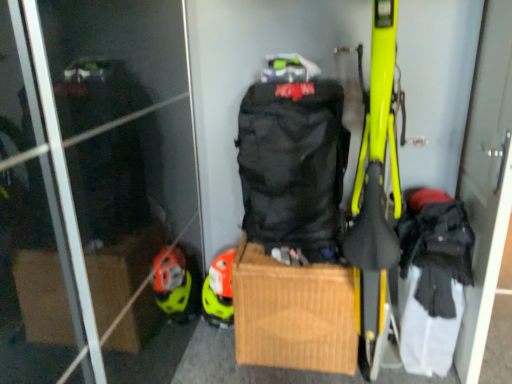
Question: Is black matte backpack at center inside or outside of brown cardboard box at center?

Choices:
 (A) outside
 (B) inside

Answer: (A)

Question: From a real-world perspective, relative to brown cardboard box at center, is black matte backpack at center vertically above or below?

Choices:
 (A) below
 (B) above

Answer: (B)

Question: Which of these objects is positioned farthest from the black matte backpack at center?

Choices:
 (A) brown cardboard box at center
 (B) orange matte helmet at center
 (C) black fabric backpack at right

Answer: (C)

Question: Estimate the real-world distances between objects in this image. Which object is farther from the brown cardboard box at center?

Choices:
 (A) black fabric backpack at right
 (B) black matte backpack at center
 (C) orange matte helmet at center

Answer: (A)